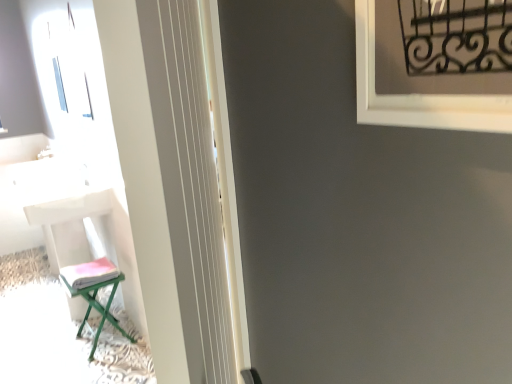
Question: Can you confirm if white glossy screen door at left is wider than black wrought iron at upper right?

Choices:
 (A) yes
 (B) no

Answer: (A)

Question: Considering the relative positions of white glossy screen door at left and black wrought iron at upper right in the image provided, is white glossy screen door at left to the left of black wrought iron at upper right from the viewer's perspective?

Choices:
 (A) no
 (B) yes

Answer: (B)

Question: Considering the relative sizes of white glossy screen door at left and black wrought iron at upper right in the image provided, is white glossy screen door at left smaller than black wrought iron at upper right?

Choices:
 (A) no
 (B) yes

Answer: (A)

Question: From a real-world perspective, is white glossy screen door at left physically above black wrought iron at upper right?

Choices:
 (A) no
 (B) yes

Answer: (A)

Question: From the image's perspective, is white glossy screen door at left on black wrought iron at upper right?

Choices:
 (A) no
 (B) yes

Answer: (A)

Question: Is black wrought iron at upper right located within white glossy screen door at left?

Choices:
 (A) no
 (B) yes

Answer: (A)

Question: Can you confirm if white plastic chair at left, the 1th furniture in the left-to-right sequence, is shorter than white glossy table at left?

Choices:
 (A) no
 (B) yes

Answer: (A)

Question: Is white plastic chair at left, marked as the second furniture in a right-to-left arrangement, to the right of white glossy table at left from the viewer's perspective?

Choices:
 (A) no
 (B) yes

Answer: (B)

Question: From the image's perspective, is white plastic chair at left, marked as the second furniture in a right-to-left arrangement, located beneath white glossy table at left?

Choices:
 (A) no
 (B) yes

Answer: (B)

Question: From a real-world perspective, is white plastic chair at left, marked as the second furniture in a right-to-left arrangement, on white glossy table at left?

Choices:
 (A) yes
 (B) no

Answer: (B)

Question: Is white plastic chair at left, marked as the second furniture in a right-to-left arrangement, positioned beyond the bounds of white glossy table at left?

Choices:
 (A) yes
 (B) no

Answer: (A)

Question: From a real-world perspective, is white plastic chair at left, marked as the second furniture in a right-to-left arrangement, under white glossy table at left?

Choices:
 (A) no
 (B) yes

Answer: (B)

Question: From a real-world perspective, is white plastic chair at left, marked as the second furniture in a right-to-left arrangement, physically below green metallic stool at lower left, the second furniture positioned from the left?

Choices:
 (A) no
 (B) yes

Answer: (A)